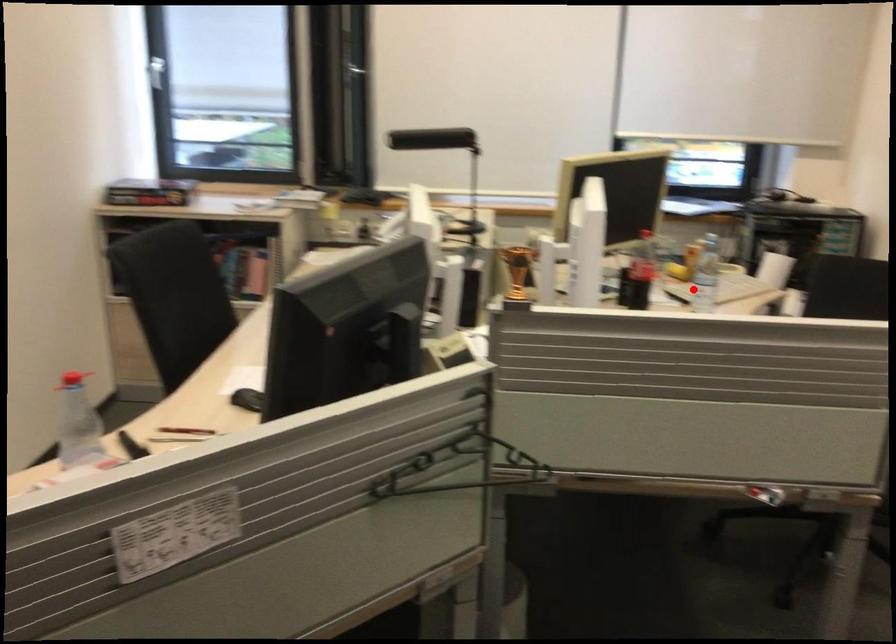
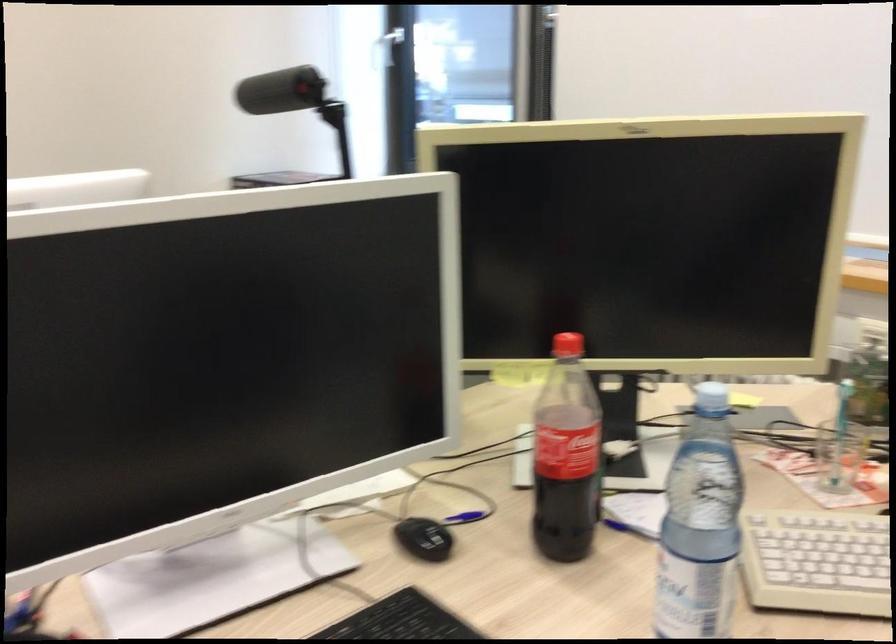
Question: I am providing you with two images of the same scene from different viewpoints. A red point is marked on the first image. At the location where the point appears in image 1, is it still visible in image 2?

Choices:
 (A) Yes
 (B) No

Answer: (A)